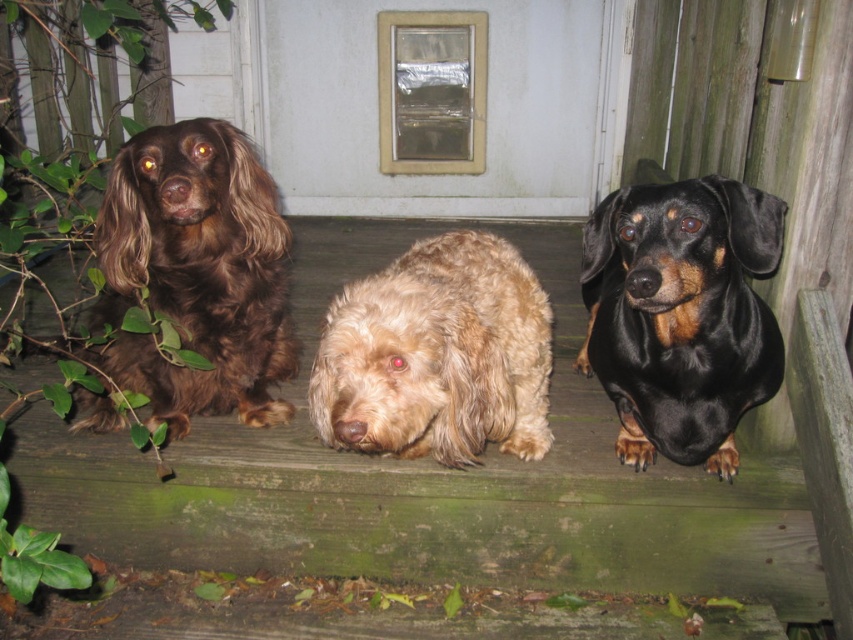
Question: Where is shiny brown fur at left located in relation to black shiny dog at center in the image?

Choices:
 (A) below
 (B) above

Answer: (B)

Question: Does shiny brown fur at left have a larger size compared to black shiny dog at center?

Choices:
 (A) yes
 (B) no

Answer: (B)

Question: Can you confirm if black shiny dog at center is positioned below fuzzy beige dog at center?

Choices:
 (A) yes
 (B) no

Answer: (B)

Question: Which object is positioned closest to the black shiny dog at center?

Choices:
 (A) fuzzy beige dog at center
 (B) shiny brown fur at left

Answer: (A)

Question: Which of these objects is positioned farthest from the shiny brown fur at left?

Choices:
 (A) black shiny dog at center
 (B) fuzzy beige dog at center

Answer: (A)

Question: Which of the following is the closest to the observer?

Choices:
 (A) (236, 364)
 (B) (619, 381)
 (C) (418, 394)

Answer: (C)